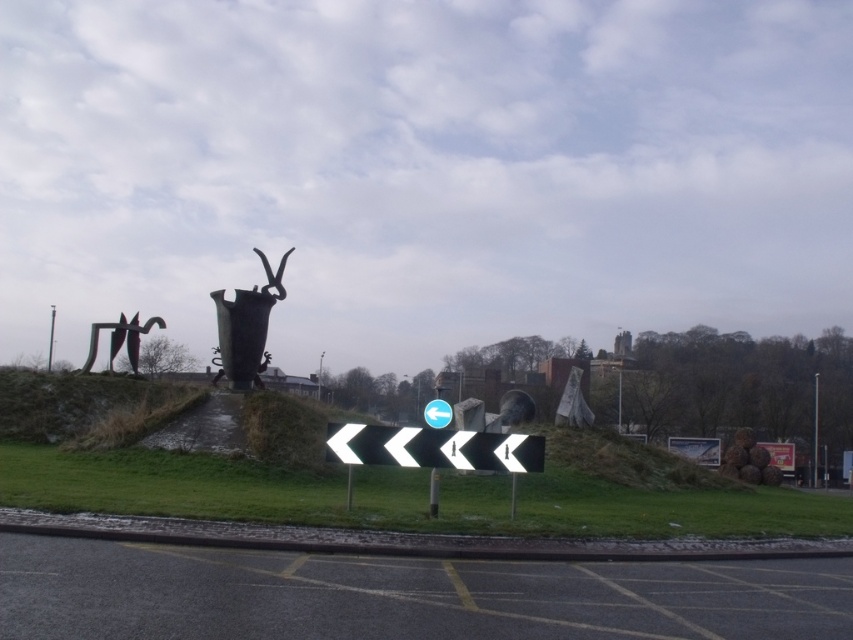
Is white plastic arrow at center in front of polished bronze sculpture at left?

Yes, it is in front of polished bronze sculpture at left.

Who is more forward, (374,433) or (131,332)?

Point (374,433) is in front.

Find the location of a particular element. white plastic arrow at center is located at coordinates click(433, 448).

Identify the location of white plastic arrow at center. The height and width of the screenshot is (640, 853). (433, 448).

Who is shorter, polished bronze vase at center or polished bronze statue at center?

polished bronze statue at center

From the picture: Can you confirm if polished bronze vase at center is wider than polished bronze statue at center?

Yes.

Does point (218, 324) lie in front of point (572, 388)?

Yes, it is.

Find the location of a particular element. polished bronze vase at center is located at coordinates (247, 326).

Who is higher up, polished bronze statue at center or metallic pole at right?

Positioned higher is polished bronze statue at center.

Between point (558, 420) and point (816, 385), which one is positioned in front?

Positioned in front is point (558, 420).

Locate an element on the screen. polished bronze statue at center is located at coordinates (573, 403).